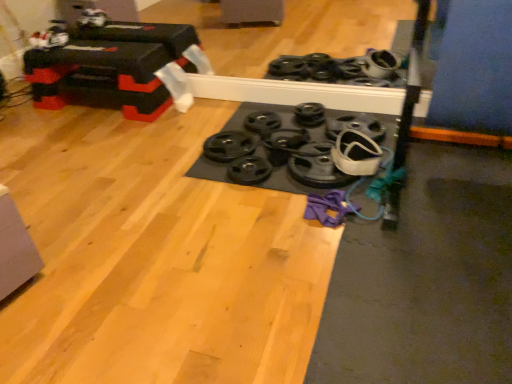
This screenshot has width=512, height=384. What do you see at coordinates (228, 146) in the screenshot?
I see `black rubber weights at center, marked as the first wheel in a left-to-right arrangement` at bounding box center [228, 146].

What do you see at coordinates (286, 139) in the screenshot? The height and width of the screenshot is (384, 512). I see `black rubber weight plate at center, the 4th wheel viewed from the right` at bounding box center [286, 139].

How much space does black rubber weight plate at center, which is counted as the 6th wheel, starting from the left, occupy vertically?

6.51 centimeters.

Locate an element on the screen. black rubber weight plate at center, which appears as the 3th wheel when viewed from the right is located at coordinates (309, 114).

From the image's perspective, which is above, black rubber weight plate at center, the fourth wheel positioned from the left, or black rubber weight plate at center, which is counted as the 6th wheel, starting from the left?

black rubber weight plate at center, the fourth wheel positioned from the left, from the image's perspective.

Is point (302, 103) closer to camera compared to point (338, 129)?

That is False.

Is black rubber weight plate at center, the fourth wheel positioned from the left, shorter than black rubber weight plate at center, which is counted as the 6th wheel, starting from the left?

In fact, black rubber weight plate at center, the fourth wheel positioned from the left, may be taller than black rubber weight plate at center, which is counted as the 6th wheel, starting from the left.

Which object is positioned more to the right, black rubber weight plate at center, the fourth wheel positioned from the left, or black rubber weight plate at center, which is counted as the 6th wheel, starting from the left?

black rubber weight plate at center, which is counted as the 6th wheel, starting from the left, is more to the right.

Are black rubber weight plate at center, the 4th wheel viewed from the right, and black rubber weight plate at center, which is counted as the 6th wheel, starting from the left, beside each other?

They are not placed beside each other.

From a real-world perspective, is black rubber weight plate at center, the 3th wheel viewed from the left, on top of black rubber weight plate at center, placed as the 1th wheel when sorted from right to left?

No, from a real-world perspective, black rubber weight plate at center, the 3th wheel viewed from the left, is not over black rubber weight plate at center, placed as the 1th wheel when sorted from right to left

Can you tell me how much black rubber weight plate at center, the 3th wheel viewed from the left, and black rubber weight plate at center, which is counted as the 6th wheel, starting from the left, differ in facing direction?

The angular difference between black rubber weight plate at center, the 3th wheel viewed from the left, and black rubber weight plate at center, which is counted as the 6th wheel, starting from the left, is 0.000345 degrees.

Is black rubber weight plate at center, the 3th wheel viewed from the left, shorter than black rubber weight plate at center, placed as the 1th wheel when sorted from right to left?

No.

Between black rubber weight plate at center, placed as the 1th wheel when sorted from right to left, and black rubber weight plate at center, the 3th wheel viewed from the left, which one appears on the left side from the viewer's perspective?

black rubber weight plate at center, the 3th wheel viewed from the left.

The image size is (512, 384). What are the coordinates of `wheel that is the 1st object located below the black rubber weight plate at center, placed as the 1th wheel when sorted from right to left (from the image's perspective)` in the screenshot? It's located at (286, 139).

From a real-world perspective, which is physically above, black rubber weight plate at center, placed as the 1th wheel when sorted from right to left, or black rubber weight plate at center, the 4th wheel viewed from the right?

black rubber weight plate at center, placed as the 1th wheel when sorted from right to left, is physically above.

Does black rubber weight plate at center, placed as the 1th wheel when sorted from right to left, touch black rubber weight plate at center, the 3th wheel viewed from the left?

No, black rubber weight plate at center, placed as the 1th wheel when sorted from right to left, is not making contact with black rubber weight plate at center, the 3th wheel viewed from the left.

Considering the relative sizes of black rubber weight plate at center, acting as the 2th wheel starting from the right, and black rubber weights at center, marked as the first wheel in a left-to-right arrangement, in the image provided, is black rubber weight plate at center, acting as the 2th wheel starting from the right, thinner than black rubber weights at center, marked as the first wheel in a left-to-right arrangement,?

No.

Does black rubber weight plate at center, acting as the 2th wheel starting from the right, have a greater height compared to black rubber weights at center, the sixth wheel positioned from the right?

Correct, black rubber weight plate at center, acting as the 2th wheel starting from the right, is much taller as black rubber weights at center, the sixth wheel positioned from the right.

Based on the photo, looking at the image, does black rubber weight plate at center, the fifth wheel in the left-to-right sequence, seem bigger or smaller compared to black rubber weights at center, marked as the first wheel in a left-to-right arrangement?

In the image, black rubber weight plate at center, the fifth wheel in the left-to-right sequence, appears to be larger than black rubber weights at center, marked as the first wheel in a left-to-right arrangement.

Considering the positions of point (334, 137) and point (248, 117), is point (334, 137) closer or farther from the camera than point (248, 117)?

Point (334, 137) appears to be closer to the viewer than point (248, 117).

From the image's perspective, does black rubber weight plate at center, placed as the 1th wheel when sorted from right to left, appear lower than black rubber weight plate at center, positioned as the 5th wheel in right-to-left order?

Yes.

Is black rubber weight plate at center, which is counted as the 6th wheel, starting from the left, looking in the opposite direction of black rubber weight plate at center, positioned as the 5th wheel in right-to-left order?

No, black rubber weight plate at center, which is counted as the 6th wheel, starting from the left, is not facing away from black rubber weight plate at center, positioned as the 5th wheel in right-to-left order.

How many degrees apart are the facing directions of black rubber weight plate at center, placed as the 1th wheel when sorted from right to left, and black rubber weight plate at center, positioned as the 5th wheel in right-to-left order?

black rubber weight plate at center, placed as the 1th wheel when sorted from right to left, and black rubber weight plate at center, positioned as the 5th wheel in right-to-left order, are facing 1.39 degrees away from each other.

Considering their positions, is black rubber weights at center, marked as the first wheel in a left-to-right arrangement, located in front of or behind black rubber weight plate at center, the 3th wheel viewed from the left?

black rubber weights at center, marked as the first wheel in a left-to-right arrangement, is positioned closer to the viewer than black rubber weight plate at center, the 3th wheel viewed from the left.

Is black rubber weight plate at center, the 3th wheel viewed from the left, surrounded by black rubber weights at center, the sixth wheel positioned from the right?

No, black rubber weight plate at center, the 3th wheel viewed from the left, is located outside of black rubber weights at center, the sixth wheel positioned from the right.

Is black rubber weights at center, marked as the first wheel in a left-to-right arrangement, not near black rubber weight plate at center, the 4th wheel viewed from the right?

black rubber weights at center, marked as the first wheel in a left-to-right arrangement, is near black rubber weight plate at center, the 4th wheel viewed from the right, not far away.

From a real-world perspective, is black rubber weights at center, marked as the first wheel in a left-to-right arrangement, located beneath black rubber weight plate at center, the 4th wheel viewed from the right?

No, from a real-world perspective, black rubber weights at center, marked as the first wheel in a left-to-right arrangement, is not under black rubber weight plate at center, the 4th wheel viewed from the right.

Is black rubber weight plate at center, which is counted as the 6th wheel, starting from the left, outside of black rubber weights at center, the sixth wheel positioned from the right?

black rubber weight plate at center, which is counted as the 6th wheel, starting from the left, lies outside black rubber weights at center, the sixth wheel positioned from the right,'s area.

Which object is more forward, black rubber weight plate at center, placed as the 1th wheel when sorted from right to left, or black rubber weights at center, marked as the first wheel in a left-to-right arrangement?

black rubber weights at center, marked as the first wheel in a left-to-right arrangement, is closer to the camera.

Is black rubber weight plate at center, placed as the 1th wheel when sorted from right to left, bigger than black rubber weights at center, marked as the first wheel in a left-to-right arrangement?

Yes, black rubber weight plate at center, placed as the 1th wheel when sorted from right to left, is bigger than black rubber weights at center, marked as the first wheel in a left-to-right arrangement.

Is black rubber weight plate at center, placed as the 1th wheel when sorted from right to left, facing away from black rubber weights at center, marked as the first wheel in a left-to-right arrangement?

No.

From a real-world perspective, count 1st wheels downward from the black rubber weight plate at center, the fourth wheel positioned from the left, and point to it. Please provide its 2D coordinates.

[(356, 126)]

Starting from the black rubber weight plate at center, placed as the 1th wheel when sorted from right to left, which wheel is the 3rd one to the left? Please provide its 2D coordinates.

[(286, 139)]

Looking at the image, which one is located closer to black rubber weight plate at center, which is counted as the 6th wheel, starting from the left, black rubber weight plate at center, the 3th wheel viewed from the left, or black rubber weight plate at center, acting as the 2th wheel starting from the right?

black rubber weight plate at center, the 3th wheel viewed from the left.

Looking at the image, which one is located closer to black rubber weight plate at center, which appears as the 3th wheel when viewed from the right, black rubber weight plate at center, the 4th wheel viewed from the right, or black rubber weight plate at center, the fifth wheel in the left-to-right sequence?

black rubber weight plate at center, the 4th wheel viewed from the right.

When comparing their distances from black rubber weight plate at center, the 4th wheel viewed from the right, does black rubber weights at center, the sixth wheel positioned from the right, or black rubber weight plate at center, the fifth wheel in the left-to-right sequence, seem closer?

black rubber weights at center, the sixth wheel positioned from the right, lies closer to black rubber weight plate at center, the 4th wheel viewed from the right, than the other object.

When comparing their distances from black rubber weight plate at center, placed as the 1th wheel when sorted from right to left, does black rubber weight plate at center, acting as the 2th wheel starting from the right, or black rubber weight plate at center, positioned as the 5th wheel in right-to-left order, seem closer?

Based on the image, black rubber weight plate at center, acting as the 2th wheel starting from the right, appears to be nearer to black rubber weight plate at center, placed as the 1th wheel when sorted from right to left.

Estimate the real-world distances between objects in this image. Which object is closer to black rubber weights at center, the sixth wheel positioned from the right, black rubber weight plate at center, the fifth wheel in the left-to-right sequence, or black rubber weight plate at center, placed as the 1th wheel when sorted from right to left?

black rubber weight plate at center, the fifth wheel in the left-to-right sequence.

Looking at the image, which one is located closer to black rubber weight plate at center, positioned as the 5th wheel in right-to-left order, black rubber weight plate at center, which appears as the 3th wheel when viewed from the right, or black rubber weight plate at center, which is counted as the 6th wheel, starting from the left?

black rubber weight plate at center, which appears as the 3th wheel when viewed from the right, is positioned closer to the anchor black rubber weight plate at center, positioned as the 5th wheel in right-to-left order.

From the image, which object appears to be nearer to black rubber weight plate at center, acting as the 2th wheel starting from the right, black rubber weight plate at center, the fourth wheel positioned from the left, or black rubber weights at center, marked as the first wheel in a left-to-right arrangement?

black rubber weights at center, marked as the first wheel in a left-to-right arrangement.

Estimate the real-world distances between objects in this image. Which object is further from black rubber weights at center, marked as the first wheel in a left-to-right arrangement, black rubber weight plate at center, the fourth wheel positioned from the left, or black rubber weight plate at center, the 4th wheel viewed from the right?

The object further to black rubber weights at center, marked as the first wheel in a left-to-right arrangement, is black rubber weight plate at center, the fourth wheel positioned from the left.

The height and width of the screenshot is (384, 512). I want to click on wheel between black rubber weight plate at center, positioned as the 5th wheel in right-to-left order, and black rubber weight plate at center, the fourth wheel positioned from the left, in the horizontal direction, so click(x=286, y=139).

You are a GUI agent. You are given a task and a screenshot of the screen. Output one action in this format:
    pyautogui.click(x=<x>, y=<y>)
    Task: Click on the wheel located between black rubber weights at center, marked as the first wheel in a left-to-right arrangement, and black rubber weight plate at center, the 3th wheel viewed from the left, in the left-right direction
    This screenshot has width=512, height=384.
    Given the screenshot: What is the action you would take?
    pyautogui.click(x=262, y=122)